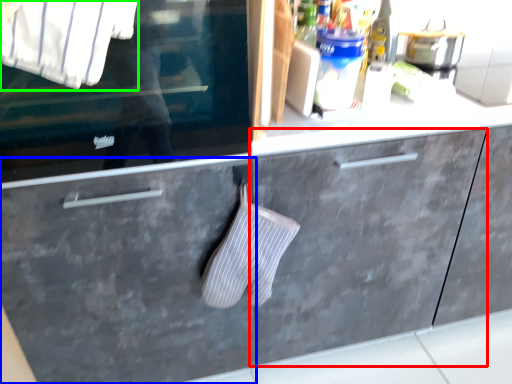
Question: Which is nearer to the cabinetry (highlighted by a red box)? drawer (highlighted by a blue box) or shirt (highlighted by a green box).

Choices:
 (A) drawer
 (B) shirt

Answer: (A)